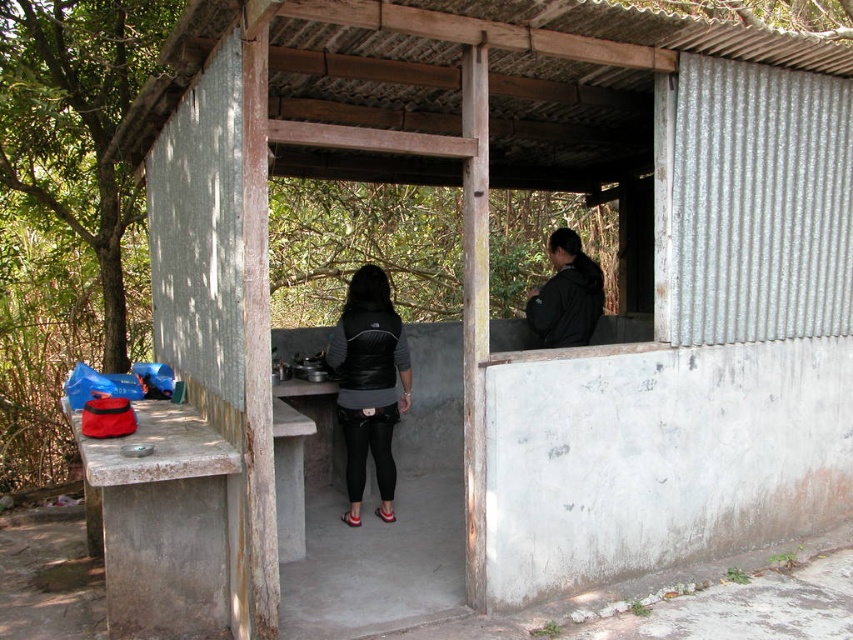
Question: Considering the relative positions of black matte vest at center and black matte jacket at upper right in the image provided, where is black matte vest at center located with respect to black matte jacket at upper right?

Choices:
 (A) below
 (B) above

Answer: (A)

Question: From the image, what is the correct spatial relationship of black matte vest at center in relation to black matte jacket at upper right?

Choices:
 (A) right
 (B) left

Answer: (B)

Question: Where is black matte vest at center located in relation to black matte jacket at upper right in the image?

Choices:
 (A) right
 (B) left

Answer: (B)